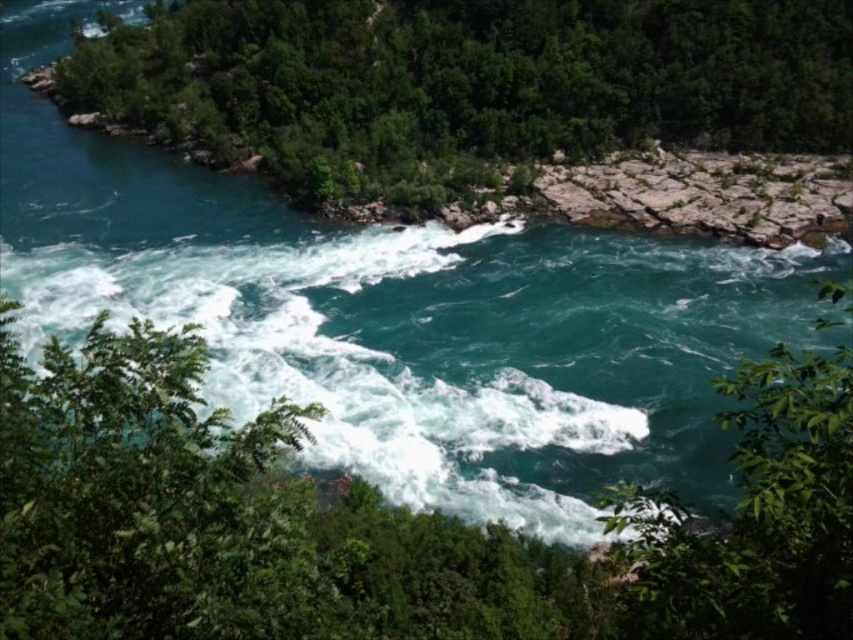
You are a hiker standing at the edge of the river and looking upstream. You see the green leafy tree at upper left and the green leafy tree at center. Which tree is closer to you?

The green leafy tree at upper left is positioned over the green leafy tree at center, which means it is closer to you.

You are standing at the point with coordinates (463, 84) in the river scene. What object is located exactly at this point?

The green leafy tree at upper left is located exactly at point (463, 84).

You are standing at the origin point of the coordinate system in the scene. Where is the green leafy tree at upper left located in terms of coordinates?

The green leafy tree at upper left is located at coordinates point [463,84].